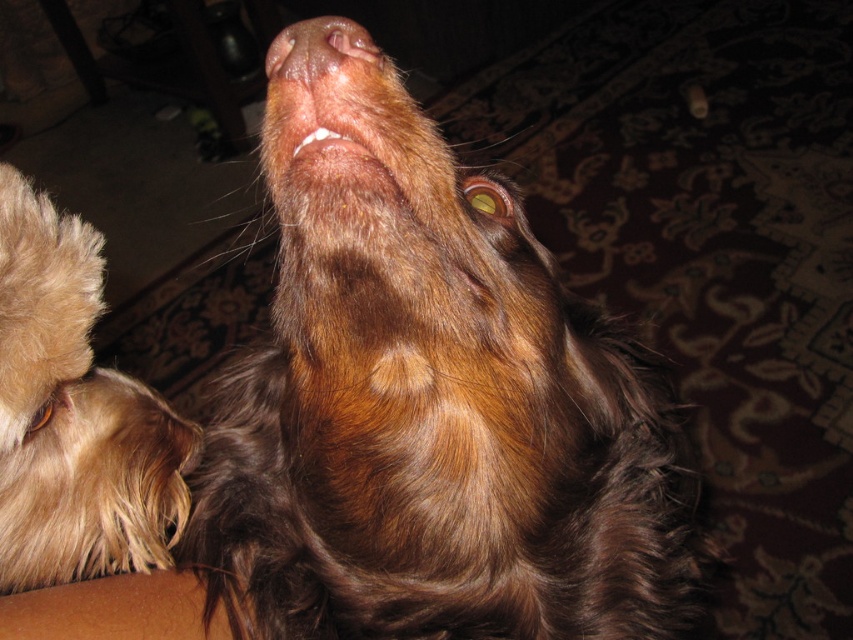
Question: Does fuzzy brown fur at lower left appear on the right side of pink smooth nose at upper center?

Choices:
 (A) yes
 (B) no

Answer: (B)

Question: Which point appears closest to the camera in this image?

Choices:
 (A) (305, 61)
 (B) (88, 458)

Answer: (A)

Question: Is fuzzy brown fur at lower left wider than pink smooth nose at upper center?

Choices:
 (A) no
 (B) yes

Answer: (B)

Question: Which point appears farthest from the camera in this image?

Choices:
 (A) (44, 284)
 (B) (343, 20)

Answer: (B)

Question: Can you confirm if fuzzy brown fur at lower left is bigger than pink smooth nose at upper center?

Choices:
 (A) no
 (B) yes

Answer: (B)